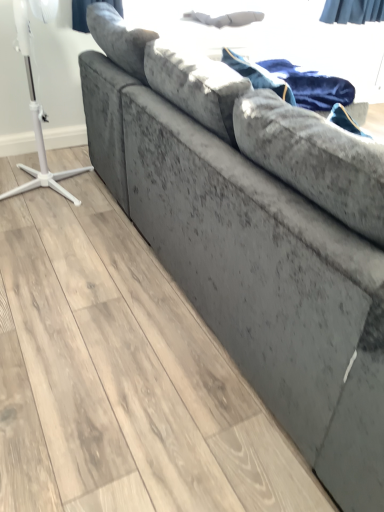
Question: Which is correct: velvet blue blanket at upper right is inside white plastic tripod at left, or outside of it?

Choices:
 (A) inside
 (B) outside

Answer: (B)

Question: Relative to white plastic tripod at left, is velvet blue blanket at upper right in front or behind?

Choices:
 (A) behind
 (B) front

Answer: (A)

Question: Considering the positions of velvet blue blanket at upper right and white plastic tripod at left in the image, is velvet blue blanket at upper right taller or shorter than white plastic tripod at left?

Choices:
 (A) tall
 (B) short

Answer: (B)

Question: Based on their sizes in the image, would you say white plastic tripod at left is bigger or smaller than velvet blue blanket at upper right?

Choices:
 (A) big
 (B) small

Answer: (A)

Question: From the image's perspective, is white plastic tripod at left located above or below velvet blue blanket at upper right?

Choices:
 (A) above
 (B) below

Answer: (B)

Question: In terms of height, does white plastic tripod at left look taller or shorter compared to velvet blue blanket at upper right?

Choices:
 (A) tall
 (B) short

Answer: (A)

Question: Visually, is white plastic tripod at left positioned to the left or to the right of velvet blue blanket at upper right?

Choices:
 (A) right
 (B) left

Answer: (B)